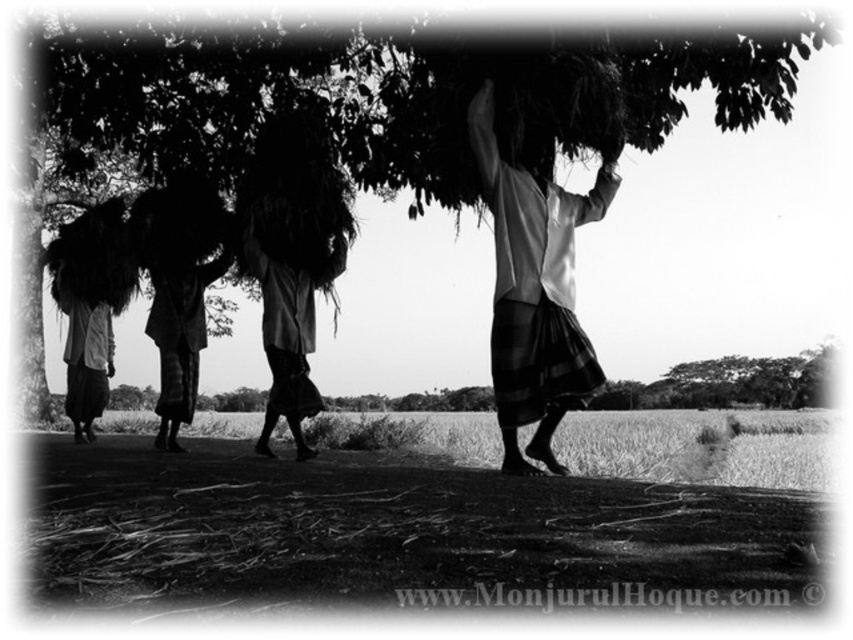
Question: Which point appears closest to the camera in this image?

Choices:
 (A) (548, 236)
 (B) (306, 406)

Answer: (A)

Question: Where is white fabric basket at center located in relation to dark fabric bundle at center in the image?

Choices:
 (A) right
 (B) left

Answer: (A)

Question: Which is farther from the white fabric basket at center?

Choices:
 (A) green leafy tree at upper center
 (B) dark fabric bundle at center

Answer: (A)

Question: Which point is farther to the camera?

Choices:
 (A) (323, 225)
 (B) (550, 56)

Answer: (A)

Question: From the image, what is the correct spatial relationship of white fabric basket at center in relation to dark fabric bundle at center?

Choices:
 (A) left
 (B) right

Answer: (B)

Question: Is green leafy tree at upper center above dark fabric bundle at center?

Choices:
 (A) yes
 (B) no

Answer: (A)